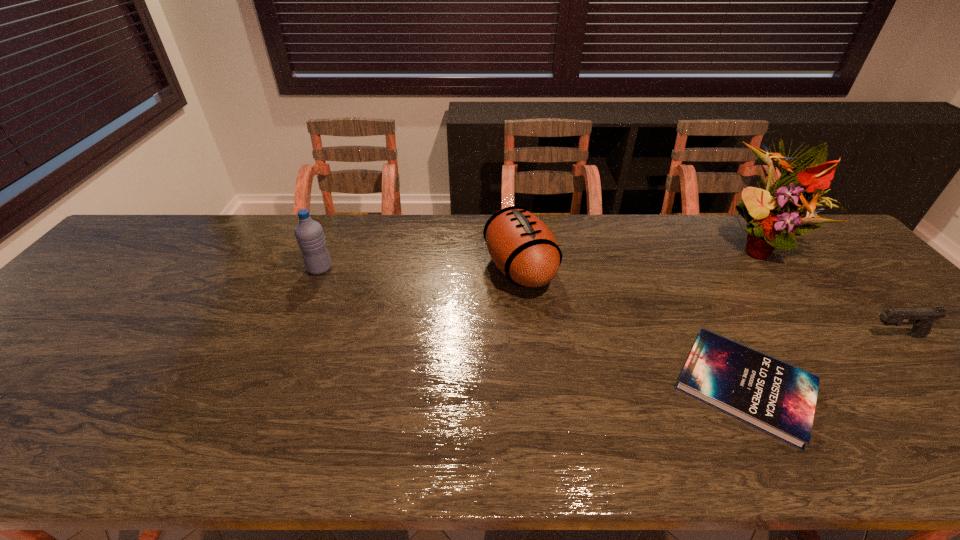
Identify the location of vacant point at the near edge. The image size is (960, 540). (88, 430).

This screenshot has width=960, height=540. Find the location of `free spot at the left edge of the desktop`. free spot at the left edge of the desktop is located at coordinates (117, 289).

Where is `vacant region at the right edge`? vacant region at the right edge is located at coordinates (904, 340).

Identify the location of free spot between the leftmost object and the shortest object. (533, 327).

The width and height of the screenshot is (960, 540). I want to click on free spot between the fourth tallest object and the bouquet, so click(x=827, y=291).

The height and width of the screenshot is (540, 960). Identify the location of vacant space that's between the fourth tallest object and the bouquet. (827, 291).

Where is `free space between the water bottle and the football (American)`? free space between the water bottle and the football (American) is located at coordinates (420, 268).

Where is `vacant region between the third shortest object and the leftmost object`? vacant region between the third shortest object and the leftmost object is located at coordinates (420, 268).

Locate an element on the screen. Image resolution: width=960 pixels, height=540 pixels. vacant region between the water bottle and the hardback book is located at coordinates (533, 327).

This screenshot has height=540, width=960. I want to click on free space between the football (American) and the water bottle, so tap(420, 268).